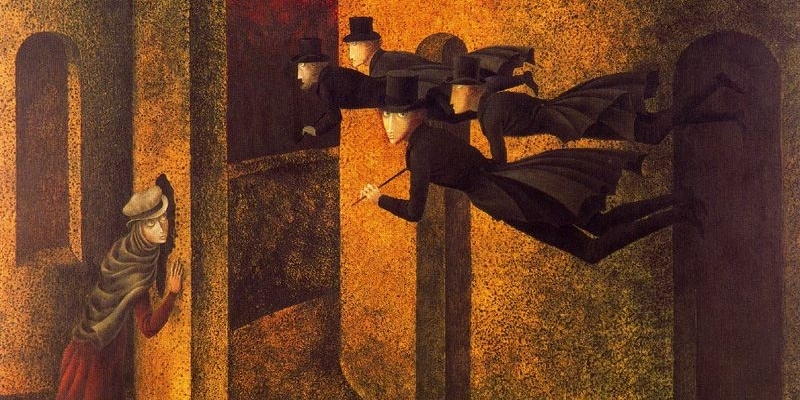
The width and height of the screenshot is (800, 400). In order to click on door in this screenshot , I will do `click(458, 268)`.